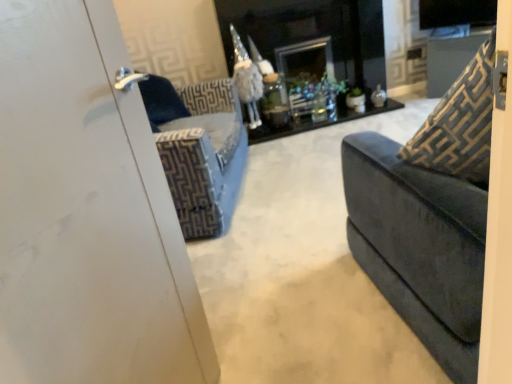
Question: In terms of width, does black glossy fireplace at center look wider or thinner when compared to gold-patterned fabric at right?

Choices:
 (A) wide
 (B) thin

Answer: (A)

Question: Is point (293, 16) positioned closer to the camera than point (488, 74)?

Choices:
 (A) closer
 (B) farther

Answer: (B)

Question: From a real-world perspective, relative to gold-patterned fabric at right, is black glossy fireplace at center vertically above or below?

Choices:
 (A) above
 (B) below

Answer: (B)

Question: In terms of size, does gold-patterned fabric at right appear bigger or smaller than black glossy fireplace at center?

Choices:
 (A) small
 (B) big

Answer: (A)

Question: Considering the positions of point (404, 148) and point (305, 127), is point (404, 148) closer or farther from the camera than point (305, 127)?

Choices:
 (A) farther
 (B) closer

Answer: (B)

Question: From a real-world perspective, relative to black glossy fireplace at center, is gold-patterned fabric at right vertically above or below?

Choices:
 (A) below
 (B) above

Answer: (B)

Question: Considering the relative positions of gold-patterned fabric at right and black glossy fireplace at center in the image provided, is gold-patterned fabric at right to the left or to the right of black glossy fireplace at center?

Choices:
 (A) right
 (B) left

Answer: (A)